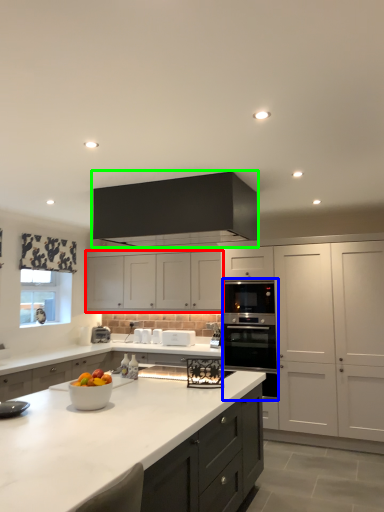
Question: Which is nearer to the cabinetry (highlighted by a red box)? oven (highlighted by a blue box) or cabinetry (highlighted by a green box).

Choices:
 (A) oven
 (B) cabinetry

Answer: (A)